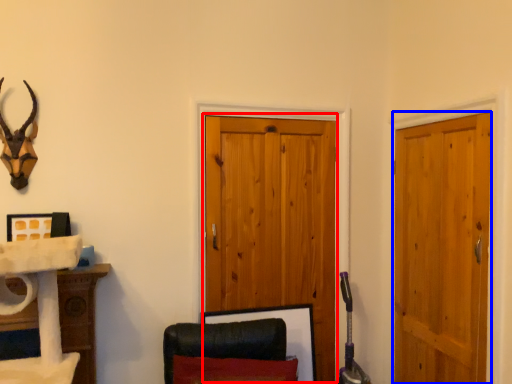
Question: Among these objects, which one is nearest to the camera, barn door (highlighted by a red box) or door (highlighted by a blue box)?

Choices:
 (A) barn door
 (B) door

Answer: (B)